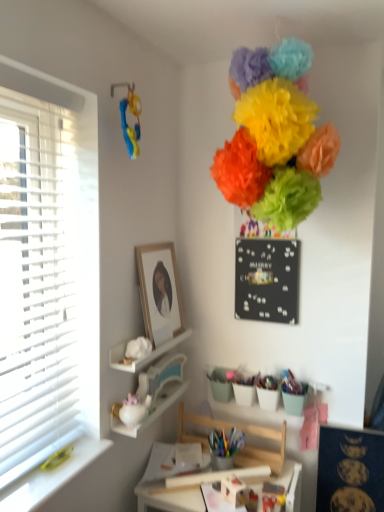
Question: Considering the relative sizes of white glossy teapot at lower left, marked as the 1th shelf in a bottom-to-top arrangement, and black matte bulletin board at upper center, positioned as the 2th bulletin board in bottom-to-top order, in the image provided, is white glossy teapot at lower left, marked as the 1th shelf in a bottom-to-top arrangement, smaller than black matte bulletin board at upper center, positioned as the 2th bulletin board in bottom-to-top order,?

Choices:
 (A) yes
 (B) no

Answer: (A)

Question: From a real-world perspective, is white glossy teapot at lower left, marked as the 1th shelf in a bottom-to-top arrangement, beneath black matte bulletin board at upper center, the 2th bulletin board when ordered from right to left?

Choices:
 (A) yes
 (B) no

Answer: (A)

Question: Could you tell me if white glossy teapot at lower left, marked as the 1th shelf in a bottom-to-top arrangement, is facing black matte bulletin board at upper center, which ranks as the first bulletin board in top-to-bottom order?

Choices:
 (A) no
 (B) yes

Answer: (A)

Question: Considering the relative sizes of white glossy teapot at lower left, marked as the 1th shelf in a bottom-to-top arrangement, and black matte bulletin board at upper center, the 2th bulletin board when ordered from right to left, in the image provided, is white glossy teapot at lower left, marked as the 1th shelf in a bottom-to-top arrangement, taller than black matte bulletin board at upper center, the 2th bulletin board when ordered from right to left,?

Choices:
 (A) yes
 (B) no

Answer: (B)

Question: Is white glossy teapot at lower left, acting as the second shelf starting from the top, positioned with its back to black matte bulletin board at upper center, the 2th bulletin board when ordered from right to left?

Choices:
 (A) no
 (B) yes

Answer: (A)

Question: From the image's perspective, is wooden framed portrait at upper center above or below wooden desk at center?

Choices:
 (A) above
 (B) below

Answer: (A)

Question: Is wooden framed portrait at upper center bigger or smaller than wooden desk at center?

Choices:
 (A) small
 (B) big

Answer: (A)

Question: Looking at their shapes, would you say wooden framed portrait at upper center is wider or thinner than wooden desk at center?

Choices:
 (A) thin
 (B) wide

Answer: (A)

Question: In terms of height, does wooden framed portrait at upper center look taller or shorter compared to wooden desk at center?

Choices:
 (A) tall
 (B) short

Answer: (A)

Question: Looking at the image, does matte paper pom-poms at upper center seem bigger or smaller compared to black matte bulletin board at upper center, the 2th bulletin board when ordered from right to left?

Choices:
 (A) big
 (B) small

Answer: (A)

Question: Which is correct: matte paper pom-poms at upper center is inside black matte bulletin board at upper center, the 2th bulletin board when ordered from right to left, or outside of it?

Choices:
 (A) inside
 (B) outside

Answer: (B)

Question: Is matte paper pom-poms at upper center in front of or behind black matte bulletin board at upper center, positioned as the 2th bulletin board in bottom-to-top order, in the image?

Choices:
 (A) behind
 (B) front

Answer: (B)

Question: Looking at their shapes, would you say matte paper pom-poms at upper center is wider or thinner than black matte bulletin board at upper center, arranged as the first bulletin board when viewed from the left?

Choices:
 (A) thin
 (B) wide

Answer: (B)

Question: Does point (192, 437) appear closer or farther from the camera than point (137, 424)?

Choices:
 (A) farther
 (B) closer

Answer: (A)

Question: From the image's perspective, is wooden swivel chair at center located above or below white glossy teapot at lower left, marked as the 1th shelf in a bottom-to-top arrangement?

Choices:
 (A) above
 (B) below

Answer: (B)